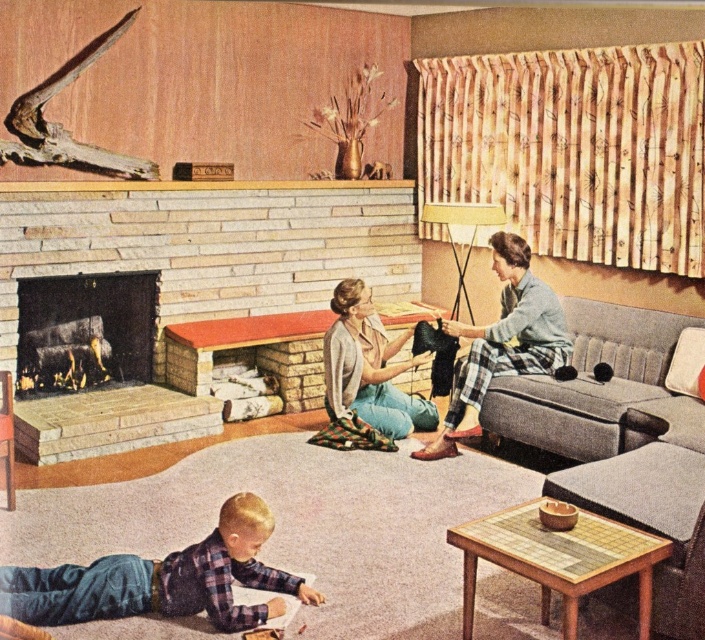
Between black stone fireplace at center and matte gray sweater at center, which one is positioned higher?

black stone fireplace at center is higher up.

The height and width of the screenshot is (640, 705). What do you see at coordinates (85, 330) in the screenshot? I see `black stone fireplace at center` at bounding box center [85, 330].

What do you see at coordinates (85, 330) in the screenshot?
I see `black stone fireplace at center` at bounding box center [85, 330].

Where is `black stone fireplace at center`? black stone fireplace at center is located at coordinates (85, 330).

This screenshot has width=705, height=640. What do you see at coordinates (502, 342) in the screenshot? I see `plaid pajama pants at center` at bounding box center [502, 342].

Looking at this image, which is more to the right, plaid pajama pants at center or matte gray sweater at center?

Positioned to the right is plaid pajama pants at center.

Where is `plaid pajama pants at center`? plaid pajama pants at center is located at coordinates (502, 342).

Does stone fireplace at center have a lesser height compared to black stone fireplace at center?

No, stone fireplace at center is not shorter than black stone fireplace at center.

Describe the element at coordinates (209, 243) in the screenshot. I see `stone fireplace at center` at that location.

I want to click on stone fireplace at center, so click(209, 243).

You are a GUI agent. You are given a task and a screenshot of the screen. Output one action in this format:
    pyautogui.click(x=<x>, y=<y>)
    Task: Click on the stone fireplace at center
    This screenshot has width=705, height=640.
    Given the screenshot: What is the action you would take?
    pyautogui.click(x=209, y=243)